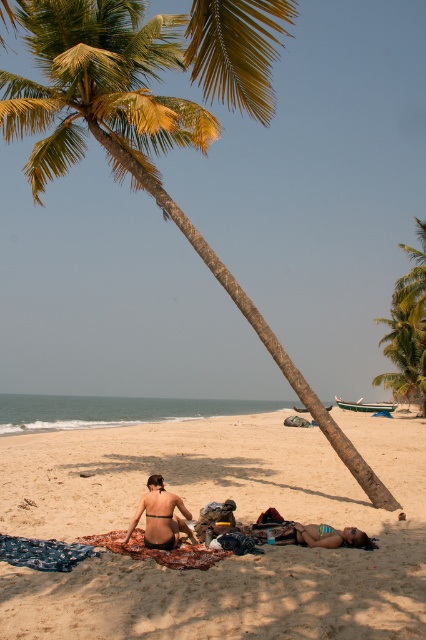
Between point (163, 518) and point (83, 538), which one is positioned in front?

Point (163, 518) is in front.

From the picture: Between matte black bikini at center and multicolored woven blanket at center, which one is positioned higher?

matte black bikini at center is above.

Between point (175, 529) and point (207, 552), which one is positioned in front?

Positioned in front is point (207, 552).

The image size is (426, 640). I want to click on matte black bikini at center, so click(x=160, y=516).

Does bright pink bikini at center appear over multicolored woven blanket at center?

Indeed, bright pink bikini at center is positioned over multicolored woven blanket at center.

Is bright pink bikini at center wider than multicolored woven blanket at center?

Indeed, bright pink bikini at center has a greater width compared to multicolored woven blanket at center.

Which is in front, point (172, 518) or point (126, 541)?

Point (172, 518) is more forward.

This screenshot has width=426, height=640. Identify the location of bright pink bikini at center. (308, 532).

Which is more to the right, beige sandy beach at center or bright pink bikini at center?

bright pink bikini at center is more to the right.

Is beige sandy beach at center above bright pink bikini at center?

No, beige sandy beach at center is not above bright pink bikini at center.

Find the location of a particular element. The width and height of the screenshot is (426, 640). beige sandy beach at center is located at coordinates (236, 518).